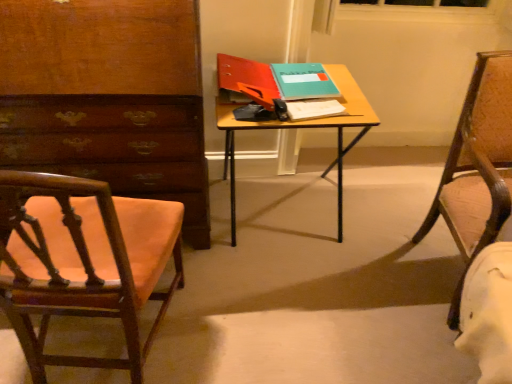
Question: Is white paper notepad at center outside of teal matte book at center, the 2th book from the left?

Choices:
 (A) no
 (B) yes

Answer: (B)

Question: Is the surface of white paper notepad at center in direct contact with teal matte book at center, the 2th book from the left?

Choices:
 (A) no
 (B) yes

Answer: (A)

Question: Does white paper notepad at center lie behind teal matte book at center, acting as the 1th book starting from the right?

Choices:
 (A) no
 (B) yes

Answer: (A)

Question: Is teal matte book at center, acting as the 1th book starting from the right, a part of white paper notepad at center?

Choices:
 (A) yes
 (B) no

Answer: (B)

Question: From the image's perspective, is white paper notepad at center above teal matte book at center, acting as the 1th book starting from the right?

Choices:
 (A) yes
 (B) no

Answer: (B)

Question: From the image's perspective, would you say white paper notepad at center is shown under teal matte book at center, the 2th book from the left?

Choices:
 (A) yes
 (B) no

Answer: (A)

Question: Is white paper notepad at center positioned with its back to matte red folder at center, which is the first book in left-to-right order?

Choices:
 (A) yes
 (B) no

Answer: (B)

Question: Is white paper notepad at center bigger than matte red folder at center, which is the first book in left-to-right order?

Choices:
 (A) yes
 (B) no

Answer: (B)

Question: Is white paper notepad at center outside of matte red folder at center, the 2th book viewed from the right?

Choices:
 (A) yes
 (B) no

Answer: (A)

Question: Is white paper notepad at center aimed at matte red folder at center, the 2th book viewed from the right?

Choices:
 (A) yes
 (B) no

Answer: (B)

Question: Is white paper notepad at center shorter than matte red folder at center, the 2th book viewed from the right?

Choices:
 (A) yes
 (B) no

Answer: (A)

Question: From the image's perspective, is white paper notepad at center under matte red folder at center, the 2th book viewed from the right?

Choices:
 (A) yes
 (B) no

Answer: (A)

Question: Can you confirm if wooden chair at left, acting as the first chair starting from the left, is bigger than leather-like brown chair at right, which is the second chair from left to right?

Choices:
 (A) no
 (B) yes

Answer: (A)